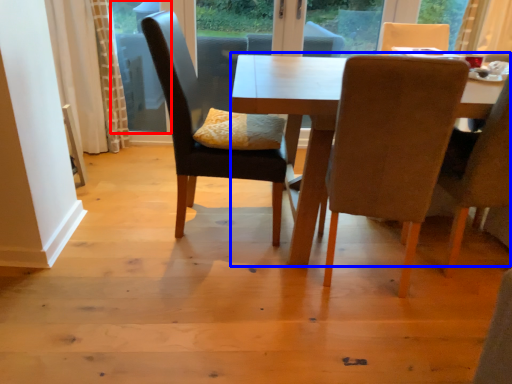
Question: Which of the following is the closest to the observer, window screen (highlighted by a red box) or kitchen & dining room table (highlighted by a blue box)?

Choices:
 (A) window screen
 (B) kitchen & dining room table

Answer: (B)